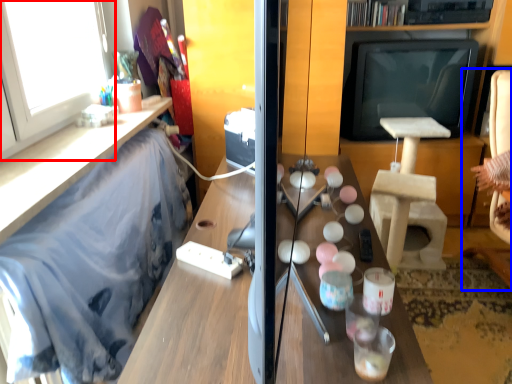
Question: Which object is further to the camera taking this photo, window (highlighted by a red box) or swivel chair (highlighted by a blue box)?

Choices:
 (A) window
 (B) swivel chair

Answer: (B)